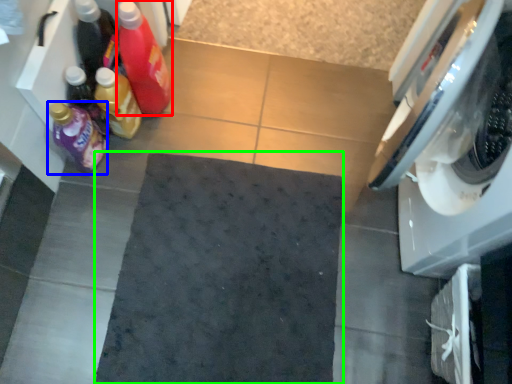
Question: Which object is positioned closest to bottle (highlighted by a red box)? Select from bottle (highlighted by a blue box) and bath mat (highlighted by a green box).

Choices:
 (A) bottle
 (B) bath mat

Answer: (A)